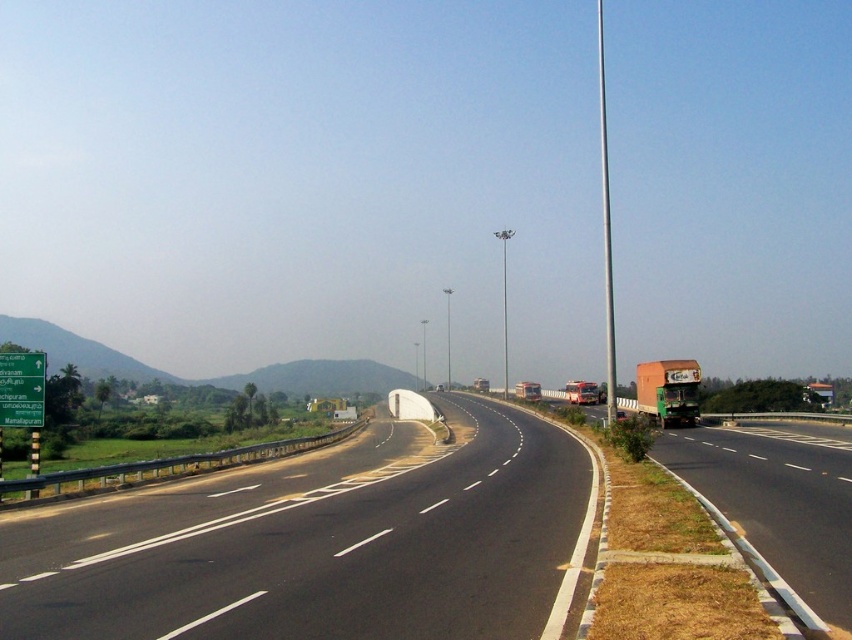
Question: Which object appears farthest from the camera in this image?

Choices:
 (A) green matte truck at right
 (B) black asphalt highway at center

Answer: (B)

Question: Can you confirm if green plastic sign at upper left is positioned above silver metallic pole at right?

Choices:
 (A) yes
 (B) no

Answer: (B)

Question: Which of the following is the farthest from the observer?

Choices:
 (A) (602, 72)
 (B) (655, 369)

Answer: (A)

Question: Among these objects, which one is nearest to the camera?

Choices:
 (A) black asphalt highway at center
 (B) orange matte trailer truck at right
 (C) green matte truck at right

Answer: (C)

Question: From the image, what is the correct spatial relationship of green matte truck at right in relation to green plastic sign at upper left?

Choices:
 (A) left
 (B) right

Answer: (B)

Question: Can you confirm if black asphalt highway at center is positioned to the left of green plastic sign at upper left?

Choices:
 (A) yes
 (B) no

Answer: (B)